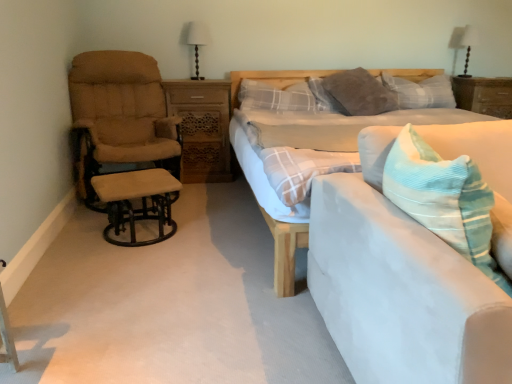
What do you see at coordinates (484, 95) in the screenshot? I see `wooden nightstand at right, marked as the second nightstand in a left-to-right arrangement` at bounding box center [484, 95].

This screenshot has height=384, width=512. What do you see at coordinates (276, 97) in the screenshot?
I see `plaid fabric pillow at center, which is the third pillow from right to left` at bounding box center [276, 97].

What is the approximate width of beige fabric stool at left?

beige fabric stool at left is 17.25 inches in width.

At what (x,y) coordinates should I click in order to perform the action: click on wooden nightstand at right, the first nightstand positioned from the right. Please return your answer as a coordinate pair (x, y). This screenshot has width=512, height=384. Looking at the image, I should click on (484, 95).

Relative to plaid fabric pillow at center, the first pillow when ordered from left to right, is beige fabric recliner at left in front or behind?

Clearly, beige fabric recliner at left is in front of plaid fabric pillow at center, the first pillow when ordered from left to right.

Which is more distant, (x=81, y=53) or (x=292, y=99)?

Positioned behind is point (x=292, y=99).

Would you say beige fabric recliner at left contains plaid fabric pillow at center, which is the third pillow from right to left?

No, plaid fabric pillow at center, which is the third pillow from right to left, is located outside of beige fabric recliner at left.

Between beige fabric recliner at left and plaid fabric pillow at center, the first pillow when ordered from left to right, which one has less height?

plaid fabric pillow at center, the first pillow when ordered from left to right, is shorter.

Is beige fabric stool at left behind white fabric lampshade at upper right, which appears as the first table lamp when viewed from the right?

No, it is not.

Which object is wider, beige fabric stool at left or white fabric lampshade at upper right, which ranks as the 1th table lamp in back-to-front order?

beige fabric stool at left.

Which is closer to the camera, (112, 179) or (462, 32)?

Clearly, point (112, 179) is closer to the camera than point (462, 32).

Is beige fabric stool at left outside of white fabric lampshade at upper right, which ranks as the 1th table lamp in back-to-front order?

Absolutely, beige fabric stool at left is external to white fabric lampshade at upper right, which ranks as the 1th table lamp in back-to-front order.

Is plaid fabric pillow at upper center, positioned as the first pillow in right-to-left order, situated inside beige fabric stool at left or outside?

plaid fabric pillow at upper center, positioned as the first pillow in right-to-left order, is not inside beige fabric stool at left, it's outside.

Does plaid fabric pillow at upper center, the 3th pillow when ordered from left to right, have a lesser width compared to beige fabric stool at left?

Yes, plaid fabric pillow at upper center, the 3th pillow when ordered from left to right, is thinner than beige fabric stool at left.

Is point (422, 107) closer or farther from the camera than point (168, 187)?

Point (422, 107).

Is plaid fabric pillow at upper center, the 3th pillow when ordered from left to right, not near beige fabric stool at left?

Yes, plaid fabric pillow at upper center, the 3th pillow when ordered from left to right, is far from beige fabric stool at left.

Is light blue fabric bed at center turned away from beige fabric stool at left?

No, beige fabric stool at left is not at the back of light blue fabric bed at center.

Which point is more forward, (327, 74) or (147, 177)?

The point (147, 177) is in front.

Is light blue fabric bed at center situated inside beige fabric stool at left or outside?

light blue fabric bed at center is located beyond the bounds of beige fabric stool at left.

Who is shorter, light blue fabric bed at center or beige fabric stool at left?

beige fabric stool at left.

Is plaid fabric pillow at upper center, the 3th pillow when ordered from left to right, far from beige fabric recliner at left?

Yes, plaid fabric pillow at upper center, the 3th pillow when ordered from left to right, and beige fabric recliner at left are quite far apart.

Is plaid fabric pillow at upper center, the 3th pillow when ordered from left to right, turned away from beige fabric recliner at left?

No, plaid fabric pillow at upper center, the 3th pillow when ordered from left to right, is not facing the opposite direction of beige fabric recliner at left.

Does plaid fabric pillow at upper center, the 3th pillow when ordered from left to right, lie behind beige fabric recliner at left?

That is True.

Which of these two, plaid fabric pillow at upper center, the 3th pillow when ordered from left to right, or beige fabric recliner at left, is smaller?

plaid fabric pillow at upper center, the 3th pillow when ordered from left to right.

Who is bigger, beige fabric recliner at left or white fabric-covered table lamp at upper center, the first table lamp in the front-to-back sequence?

beige fabric recliner at left.

Is beige fabric recliner at left thinner than white fabric-covered table lamp at upper center, the second table lamp in the right-to-left sequence?

No, beige fabric recliner at left is not thinner than white fabric-covered table lamp at upper center, the second table lamp in the right-to-left sequence.

From the image's perspective, who appears lower, beige fabric recliner at left or white fabric-covered table lamp at upper center, the first table lamp viewed from the left?

beige fabric recliner at left is shown below in the image.

From the image's perspective, between beige fabric recliner at left and beige fabric stool at left, which one is located above?

beige fabric recliner at left.

Would you consider beige fabric recliner at left to be distant from beige fabric stool at left?

No, beige fabric recliner at left is not far away from beige fabric stool at left.

Is beige fabric recliner at left smaller than beige fabric stool at left?

No, beige fabric recliner at left is not smaller than beige fabric stool at left.

Find the location of a particular element. The width and height of the screenshot is (512, 384). pillow that is the 2nd one above the beige fabric recliner at left (from a real-world perspective) is located at coordinates (276, 97).

Image resolution: width=512 pixels, height=384 pixels. What are the coordinates of `table in front of the white fabric lampshade at upper right, which appears as the first table lamp when viewed from the right` in the screenshot? It's located at (135, 198).

From the image, which object appears to be farther from corduroy blue throw pillow at center, white fabric-covered table lamp at upper center, the second table lamp from the back, or light blue fabric bed at center?

white fabric-covered table lamp at upper center, the second table lamp from the back, lies further to corduroy blue throw pillow at center than the other object.

Based on their spatial positions, is plaid fabric pillow at upper center, the 3th pillow when ordered from left to right, or wooden carved nightstand at center, the second nightstand from the right, further from beige fabric stool at left?

plaid fabric pillow at upper center, the 3th pillow when ordered from left to right.

From the image, which object appears to be nearer to wooden carved nightstand at center, marked as the first nightstand in a left-to-right arrangement, light blue fabric couch at right or beige fabric recliner at left?

beige fabric recliner at left is closer to wooden carved nightstand at center, marked as the first nightstand in a left-to-right arrangement.

Consider the image. From the image, which object appears to be nearer to light blue fabric couch at right, plaid fabric pillow at center, which is the third pillow from right to left, or white fabric-covered table lamp at upper center, the second table lamp from the back?

Based on the image, plaid fabric pillow at center, which is the third pillow from right to left, appears to be nearer to light blue fabric couch at right.

Looking at the image, which one is located further to light blue fabric bed at center, wooden nightstand at right, the first nightstand positioned from the right, or plaid fabric pillow at upper center, positioned as the first pillow in right-to-left order?

The object further to light blue fabric bed at center is wooden nightstand at right, the first nightstand positioned from the right.

Estimate the real-world distances between objects in this image. Which object is further from beige fabric stool at left, light blue fabric couch at right or plaid fabric pillow at center, the first pillow when ordered from left to right?

The object further to beige fabric stool at left is light blue fabric couch at right.

From the image, which object appears to be nearer to wooden carved nightstand at center, marked as the first nightstand in a left-to-right arrangement, light blue fabric bed at center or beige fabric stool at left?

Based on the image, light blue fabric bed at center appears to be nearer to wooden carved nightstand at center, marked as the first nightstand in a left-to-right arrangement.

Estimate the real-world distances between objects in this image. Which object is closer to corduroy blue throw pillow at center, white fabric-covered table lamp at upper center, the second table lamp from the back, or wooden nightstand at right, the first nightstand positioned from the right?

The object closer to corduroy blue throw pillow at center is white fabric-covered table lamp at upper center, the second table lamp from the back.

Image resolution: width=512 pixels, height=384 pixels. I want to click on pillow between plaid fabric pillow at center, the 2th pillow viewed from the left, and wooden nightstand at right, marked as the second nightstand in a left-to-right arrangement, in the horizontal direction, so click(x=421, y=92).

This screenshot has width=512, height=384. I want to click on throw pillow between light blue fabric couch at right and light blue fabric bed at center from front to back, so click(x=444, y=199).

At what (x,y) coordinates should I click in order to perform the action: click on nightstand between white fabric-covered table lamp at upper center, the first table lamp in the front-to-back sequence, and plaid fabric pillow at center, which is the third pillow from right to left, from left to right. Please return your answer as a coordinate pair (x, y). The image size is (512, 384). Looking at the image, I should click on (202, 127).

Identify the location of throw pillow between beige fabric recliner at left and light blue fabric couch at right. (444, 199).